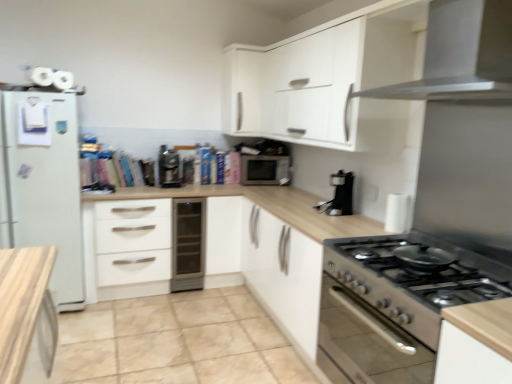
Image resolution: width=512 pixels, height=384 pixels. I want to click on white matte drawer at center, so click(132, 241).

The image size is (512, 384). Identify the location of satin silver microwave at upper center. (264, 169).

Image resolution: width=512 pixels, height=384 pixels. In order to click on black plastic coffee machine at center, the second coffee machine from the back in this screenshot , I will do `click(338, 195)`.

The width and height of the screenshot is (512, 384). Describe the element at coordinates (188, 244) in the screenshot. I see `satin silver dishwasher at center` at that location.

Locate an element on the screen. The image size is (512, 384). satin silver range hood at upper right, the 2th kitchen appliance ordered from the bottom is located at coordinates (461, 54).

Does satin black coffee machine at center, the second coffee machine in the front-to-back sequence, have a smaller size compared to stainless steel stove at lower right, the 1th kitchen appliance positioned from the bottom?

Indeed, satin black coffee machine at center, the second coffee machine in the front-to-back sequence, has a smaller size compared to stainless steel stove at lower right, the 1th kitchen appliance positioned from the bottom.

Between satin black coffee machine at center, the second coffee machine in the front-to-back sequence, and stainless steel stove at lower right, the second kitchen appliance positioned from the top, which one has larger width?

With larger width is stainless steel stove at lower right, the second kitchen appliance positioned from the top.

From a real-world perspective, is satin black coffee machine at center, the 1th coffee machine viewed from the back, located higher than stainless steel stove at lower right, the 1th kitchen appliance positioned from the bottom?

Correct, in the physical world, satin black coffee machine at center, the 1th coffee machine viewed from the back, is higher than stainless steel stove at lower right, the 1th kitchen appliance positioned from the bottom.

Does point (177, 161) come behind point (384, 278)?

Yes.

Is satin black coffee machine at center, marked as the first coffee machine in a left-to-right arrangement, spatially inside beige tile at lower center, or outside of it?

satin black coffee machine at center, marked as the first coffee machine in a left-to-right arrangement, exists outside the volume of beige tile at lower center.

From a real-world perspective, which is physically below, satin black coffee machine at center, the second coffee machine in the front-to-back sequence, or beige tile at lower center?

From a 3D spatial view, beige tile at lower center is below.

The width and height of the screenshot is (512, 384). I want to click on tile in front of the satin black coffee machine at center, marked as the first coffee machine in a left-to-right arrangement, so click(x=176, y=342).

What's the angular difference between beige tile at lower center and stainless steel stove at lower right, the 1th kitchen appliance positioned from the bottom,'s facing directions?

89.4 degrees separate the facing orientations of beige tile at lower center and stainless steel stove at lower right, the 1th kitchen appliance positioned from the bottom.

Considering the sizes of beige tile at lower center and stainless steel stove at lower right, the 1th kitchen appliance positioned from the bottom, in the image, is beige tile at lower center wider or thinner than stainless steel stove at lower right, the 1th kitchen appliance positioned from the bottom,?

Clearly, beige tile at lower center has more width compared to stainless steel stove at lower right, the 1th kitchen appliance positioned from the bottom.

Considering the relative sizes of beige tile at lower center and stainless steel stove at lower right, the 1th kitchen appliance positioned from the bottom, in the image provided, is beige tile at lower center smaller than stainless steel stove at lower right, the 1th kitchen appliance positioned from the bottom,?

Actually, beige tile at lower center might be larger than stainless steel stove at lower right, the 1th kitchen appliance positioned from the bottom.

From the image's perspective, is beige tile at lower center above or below stainless steel stove at lower right, the second kitchen appliance positioned from the top?

From the image's perspective, beige tile at lower center appears below stainless steel stove at lower right, the second kitchen appliance positioned from the top.

In terms of height, does stainless steel stove at lower right, the second kitchen appliance positioned from the top, look taller or shorter compared to satin silver dishwasher at center?

Clearly, stainless steel stove at lower right, the second kitchen appliance positioned from the top, is shorter compared to satin silver dishwasher at center.

Is stainless steel stove at lower right, the 1th kitchen appliance positioned from the bottom, far away from satin silver dishwasher at center?

Yes, stainless steel stove at lower right, the 1th kitchen appliance positioned from the bottom, is far from satin silver dishwasher at center.

Considering the relative positions of stainless steel stove at lower right, the second kitchen appliance positioned from the top, and satin silver dishwasher at center in the image provided, is stainless steel stove at lower right, the second kitchen appliance positioned from the top, to the left of satin silver dishwasher at center from the viewer's perspective?

No.

Does stainless steel stove at lower right, the 1th kitchen appliance positioned from the bottom, turn towards satin silver dishwasher at center?

No, stainless steel stove at lower right, the 1th kitchen appliance positioned from the bottom, is not aimed at satin silver dishwasher at center.

Is beige tile at lower center next to satin silver microwave at upper center and touching it?

They are not placed beside each other.

Considering the positions of points (141, 328) and (275, 171), is point (141, 328) farther from camera compared to point (275, 171)?

No, (141, 328) is in front of (275, 171).

Which of these two, beige tile at lower center or satin silver microwave at upper center, stands shorter?

beige tile at lower center is shorter.

From the image's perspective, which object appears higher, beige tile at lower center or satin silver microwave at upper center?

satin silver microwave at upper center appears higher in the image.

From the image's perspective, is satin silver range hood at upper right, the 2th kitchen appliance ordered from the bottom, under beige tile at lower center?

Actually, satin silver range hood at upper right, the 2th kitchen appliance ordered from the bottom, appears above beige tile at lower center in the image.

Can you confirm if satin silver range hood at upper right, arranged as the 1th kitchen appliance when viewed from the top, is shorter than beige tile at lower center?

No.

Is satin silver range hood at upper right, the 2th kitchen appliance ordered from the bottom, positioned far away from beige tile at lower center?

satin silver range hood at upper right, the 2th kitchen appliance ordered from the bottom, is far away from beige tile at lower center.

Is satin silver range hood at upper right, arranged as the 1th kitchen appliance when viewed from the top, not within beige tile at lower center?

satin silver range hood at upper right, arranged as the 1th kitchen appliance when viewed from the top, lies outside beige tile at lower center's area.

Find the location of a particular element. The width and height of the screenshot is (512, 384). drawer behind the stainless steel stove at lower right, the 1th kitchen appliance positioned from the bottom is located at coordinates (132, 241).

Does stainless steel stove at lower right, the second kitchen appliance positioned from the top, appear on the left side of white matte drawer at center?

In fact, stainless steel stove at lower right, the second kitchen appliance positioned from the top, is to the right of white matte drawer at center.

Which kitchen appliance is the 1st one when counting from the front of the satin black coffee machine at center, which appears as the second coffee machine when viewed from the right? Please provide its 2D coordinates.

[(393, 307)]

Identify the location of the 2nd coffee machine positioned above the beige tile at lower center (from a real-world perspective). (168, 168).

Considering their positions, is black plastic coffee machine at center, the 1th coffee machine from the front, positioned further to beige tile at lower center than satin silver dishwasher at center?

The object further to beige tile at lower center is black plastic coffee machine at center, the 1th coffee machine from the front.

Estimate the real-world distances between objects in this image. Which object is closer to white matte drawer at center, satin black coffee machine at center, which appears as the second coffee machine when viewed from the right, or beige tile at lower center?

beige tile at lower center lies closer to white matte drawer at center than the other object.

From the image, which object appears to be farther from satin silver dishwasher at center, black plastic coffee machine at center, which ranks as the 2th coffee machine in left-to-right order, or white matte cabinet at upper center?

black plastic coffee machine at center, which ranks as the 2th coffee machine in left-to-right order, is positioned further to the anchor satin silver dishwasher at center.

Based on their spatial positions, is white matte cabinet at upper center or satin silver microwave at upper center closer to white matte drawer at center?

The object closer to white matte drawer at center is satin silver microwave at upper center.

Looking at the image, which one is located further to white matte drawer at center, satin silver microwave at upper center or black plastic coffee machine at center, the second coffee machine from the back?

Among the two, black plastic coffee machine at center, the second coffee machine from the back, is located further to white matte drawer at center.

Estimate the real-world distances between objects in this image. Which object is closer to satin silver range hood at upper right, arranged as the 1th kitchen appliance when viewed from the top, beige tile at lower center or stainless steel stove at lower right, the 1th kitchen appliance positioned from the bottom?

Among the two, stainless steel stove at lower right, the 1th kitchen appliance positioned from the bottom, is located nearer to satin silver range hood at upper right, arranged as the 1th kitchen appliance when viewed from the top.

Considering their positions, is satin silver range hood at upper right, the 2th kitchen appliance ordered from the bottom, positioned further to satin silver microwave at upper center than satin silver dishwasher at center?

The object further to satin silver microwave at upper center is satin silver range hood at upper right, the 2th kitchen appliance ordered from the bottom.

Considering their positions, is white matte drawer at center positioned closer to satin silver dishwasher at center than satin silver microwave at upper center?

The object closer to satin silver dishwasher at center is white matte drawer at center.

At what (x,y) coordinates should I click in order to perform the action: click on tile between satin silver range hood at upper right, the 2th kitchen appliance ordered from the bottom, and satin silver microwave at upper center in the front-back direction. Please return your answer as a coordinate pair (x, y). Looking at the image, I should click on (176, 342).

You are a GUI agent. You are given a task and a screenshot of the screen. Output one action in this format:
    pyautogui.click(x=<x>, y=<y>)
    Task: Click on the kitchen appliance located between satin silver range hood at upper right, arranged as the 1th kitchen appliance when viewed from the top, and satin silver microwave at upper center in the depth direction
    
    Given the screenshot: What is the action you would take?
    point(393,307)

Identify the location of kitchen appliance positioned between satin silver range hood at upper right, arranged as the 1th kitchen appliance when viewed from the top, and black plastic coffee machine at center, which ranks as the 2th coffee machine in left-to-right order, from near to far. (393, 307).

At what (x,y) coordinates should I click in order to perform the action: click on cabinetry located between satin black coffee machine at center, the second coffee machine in the front-to-back sequence, and black plastic coffee machine at center, marked as the 1th coffee machine in a right-to-left arrangement, in the left-right direction. Please return your answer as a coordinate pair (x, y). The width and height of the screenshot is (512, 384). Looking at the image, I should click on (242, 89).